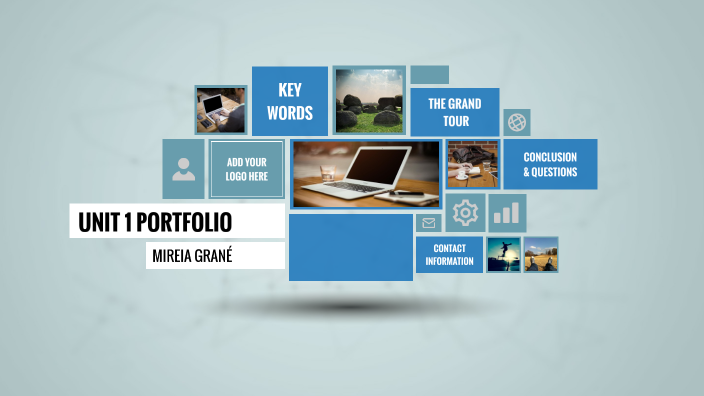
At what (x,y) coordinates should I click in order to perform the action: click on glass of water. Please return your answer as a coordinate pair (x, y). This screenshot has height=396, width=704. Looking at the image, I should click on (327, 170).